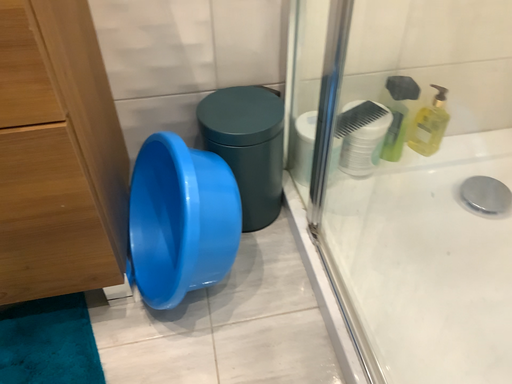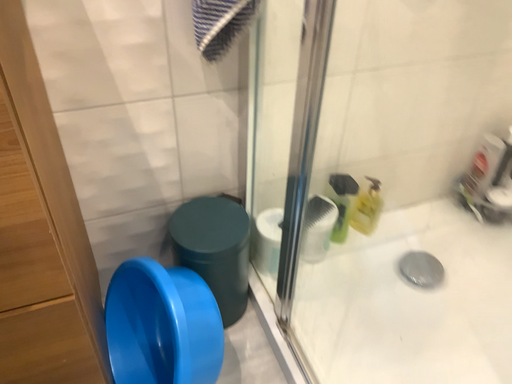
Question: Which way did the camera rotate in the video?

Choices:
 (A) rotated left
 (B) rotated right

Answer: (B)